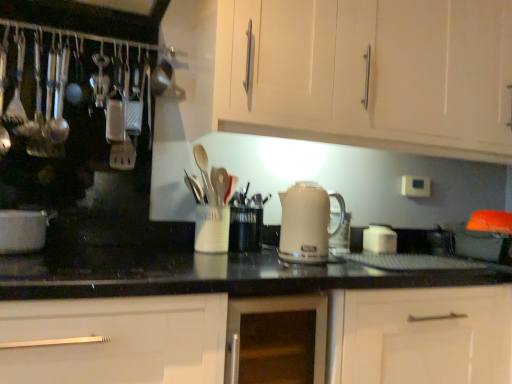
Question: Which direction should I rotate to look at white matte cabinet at upper center, arranged as the 1th cabinetry when viewed from the top?

Choices:
 (A) right
 (B) left

Answer: (A)

Question: Is white matte cup at center looking in the opposite direction of white glossy cabinet at center, which appears as the second cabinetry when viewed from the top?

Choices:
 (A) yes
 (B) no

Answer: (B)

Question: From the image's perspective, is white matte cup at center located above white glossy cabinet at center, the 1th cabinetry positioned from the bottom?

Choices:
 (A) yes
 (B) no

Answer: (A)

Question: Could you tell me if white matte cup at center is turned towards white glossy cabinet at center, the 1th cabinetry positioned from the bottom?

Choices:
 (A) no
 (B) yes

Answer: (A)

Question: Is white matte cup at center far from white glossy cabinet at center, the 1th cabinetry positioned from the bottom?

Choices:
 (A) no
 (B) yes

Answer: (A)

Question: Considering the relative positions of white matte cup at center and white glossy cabinet at center, the 1th cabinetry positioned from the bottom, in the image provided, is white matte cup at center in front of white glossy cabinet at center, the 1th cabinetry positioned from the bottom,?

Choices:
 (A) no
 (B) yes

Answer: (A)

Question: From a real-world perspective, is white matte cup at center below white glossy cabinet at center, the 1th cabinetry positioned from the bottom?

Choices:
 (A) no
 (B) yes

Answer: (A)

Question: Is white glossy pot at left not within beige glossy kettle at center?

Choices:
 (A) no
 (B) yes

Answer: (B)

Question: Considering the relative positions of white glossy pot at left and beige glossy kettle at center in the image provided, is white glossy pot at left to the right of beige glossy kettle at center from the viewer's perspective?

Choices:
 (A) no
 (B) yes

Answer: (A)

Question: Can you confirm if white glossy pot at left is taller than beige glossy kettle at center?

Choices:
 (A) yes
 (B) no

Answer: (B)

Question: Is white glossy pot at left at the left side of beige glossy kettle at center?

Choices:
 (A) yes
 (B) no

Answer: (A)

Question: Does white glossy pot at left have a larger size compared to beige glossy kettle at center?

Choices:
 (A) yes
 (B) no

Answer: (B)

Question: Does white glossy pot at left turn towards beige glossy kettle at center?

Choices:
 (A) no
 (B) yes

Answer: (A)

Question: From the image's perspective, is white matte cabinet at upper center, arranged as the 2th cabinetry when ordered from the bottom, located beneath white glossy cabinet at center, the 1th cabinetry positioned from the bottom?

Choices:
 (A) yes
 (B) no

Answer: (B)